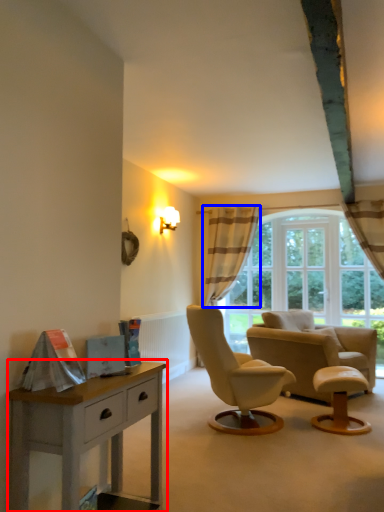
Question: Which object appears farthest to the camera in this image, nightstand (highlighted by a red box) or curtain (highlighted by a blue box)?

Choices:
 (A) nightstand
 (B) curtain

Answer: (B)